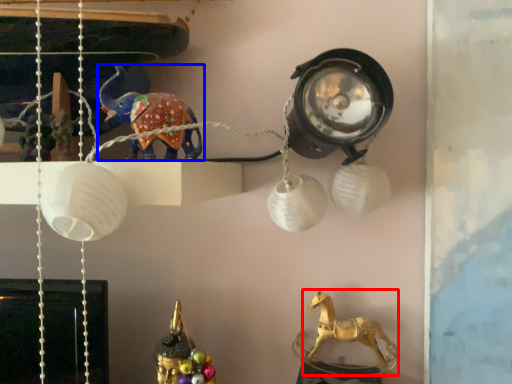
Question: Which point is further to the camera, animal (highlighted by a red box) or animal (highlighted by a blue box)?

Choices:
 (A) animal
 (B) animal

Answer: (A)